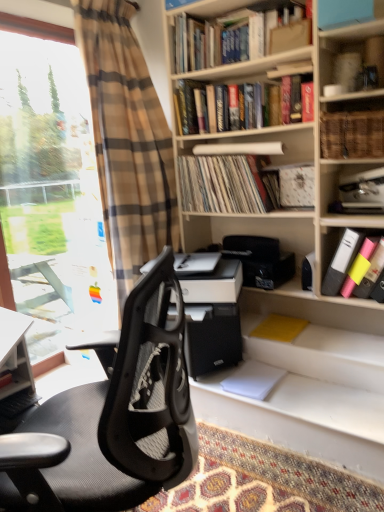
You are a GUI agent. You are given a task and a screenshot of the screen. Output one action in this format:
    pyautogui.click(x=<x>, y=<y>)
    Task: Click on the empty space that is ontop of yellow matte paper at lower right, marked as the 2th paperback book in a bottom-to-top arrangement
    The height and width of the screenshot is (512, 384).
    Given the screenshot: What is the action you would take?
    pyautogui.click(x=279, y=327)